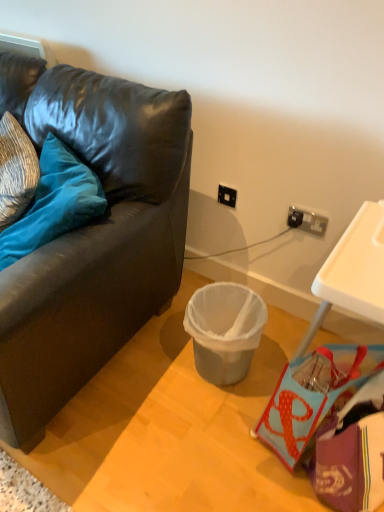
Question: Do you think matte black couch at lower left is within velvet blue pillow at left, or outside of it?

Choices:
 (A) outside
 (B) inside

Answer: (A)

Question: Is matte black couch at lower left taller or shorter than velvet blue pillow at left?

Choices:
 (A) tall
 (B) short

Answer: (A)

Question: Which is farther from the black plastic power outlet at upper right, marked as the second power outlet in a front-to-back arrangement?

Choices:
 (A) velvet blue pillow at left
 (B) gray plastic trash can at center
 (C) purple fabric handbag at lower right
 (D) matte black couch at lower left
 (E) black plastic power outlet at upper right, the second power outlet viewed from the left

Answer: (C)

Question: Which is nearer to the black plastic power outlet at upper right, marked as the second power outlet in a front-to-back arrangement?

Choices:
 (A) purple fabric handbag at lower right
 (B) gray plastic trash can at center
 (C) velvet blue pillow at left
 (D) matte black couch at lower left
 (E) black plastic power outlet at upper right, the second power outlet viewed from the left

Answer: (E)